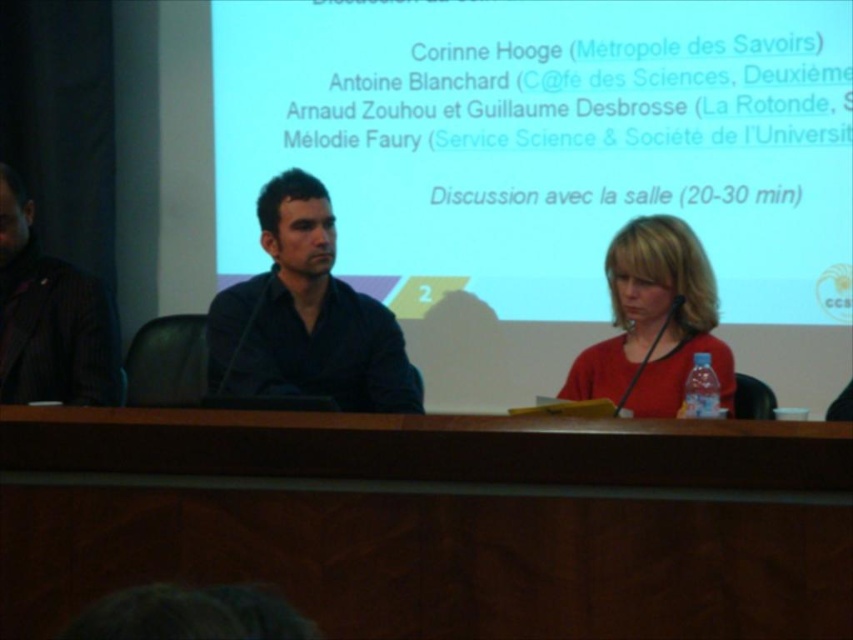
Is wooden table at center wider than dark pinstripe suit at left?

Correct, the width of wooden table at center exceeds that of dark pinstripe suit at left.

The width and height of the screenshot is (853, 640). Describe the element at coordinates (434, 520) in the screenshot. I see `wooden table at center` at that location.

This screenshot has height=640, width=853. Find the location of `wooden table at center`. wooden table at center is located at coordinates (434, 520).

Is dark blue shirt at center to the right of dark pinstripe suit at left from the viewer's perspective?

Indeed, dark blue shirt at center is positioned on the right side of dark pinstripe suit at left.

Is point (383, 397) less distant than point (18, 349)?

Yes, point (383, 397) is closer to viewer.

This screenshot has width=853, height=640. I want to click on dark blue shirt at center, so click(x=306, y=316).

Can you confirm if wooden table at center is thinner than matte red blouse at center?

No.

Does wooden table at center appear on the left side of matte red blouse at center?

Yes, wooden table at center is to the left of matte red blouse at center.

Is point (724, 589) positioned before point (643, 284)?

Yes, it is in front of point (643, 284).

The image size is (853, 640). I want to click on wooden table at center, so click(434, 520).